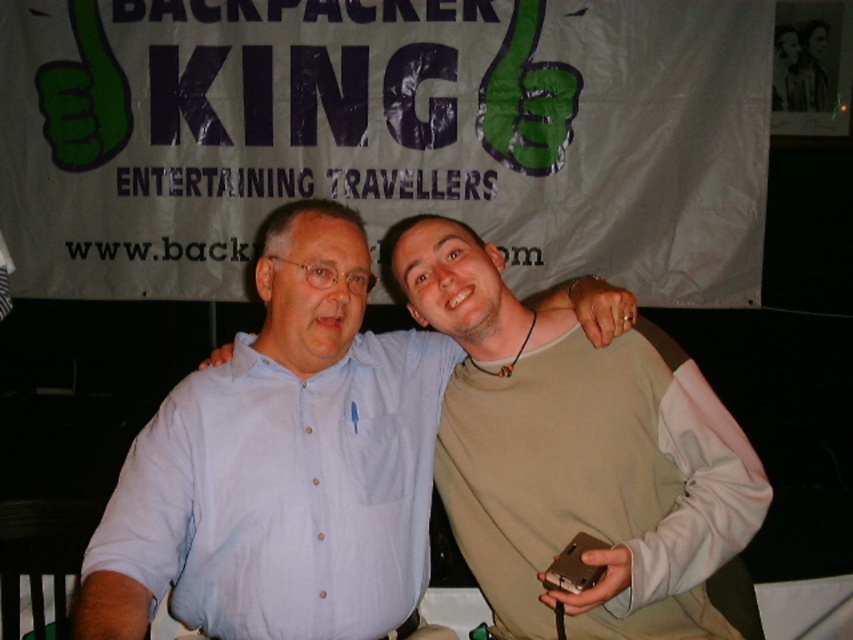
Can you confirm if beige fabric shirt at center is thinner than light blue shirt at center?

No.

Does point (431, 296) lie behind point (155, 499)?

Yes, point (431, 296) is farther from viewer.

At what (x,y) coordinates should I click in order to perform the action: click on beige fabric shirt at center. Please return your answer as a coordinate pair (x, y). Image resolution: width=853 pixels, height=640 pixels. Looking at the image, I should click on (577, 454).